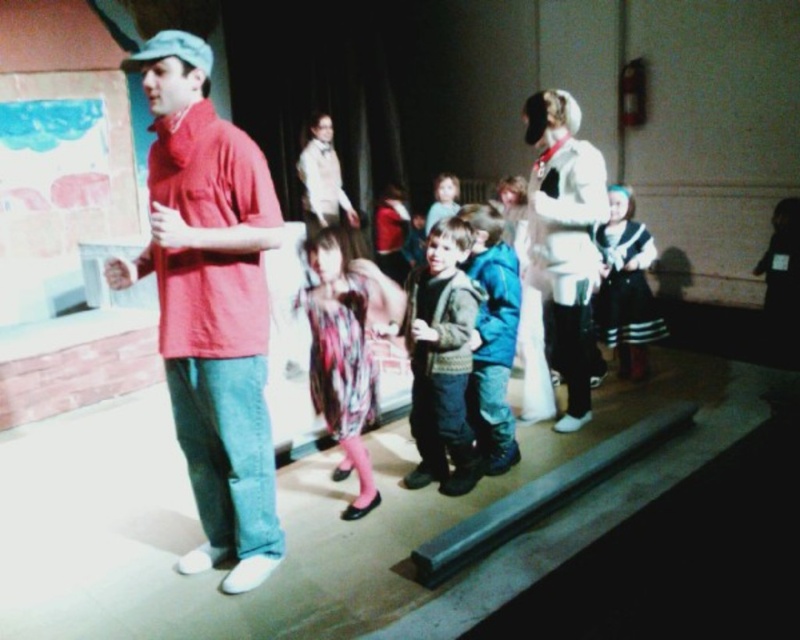
In the scene shown: You are a photographer trying to capture a group photo of the green fuzzy jacket at center and the sailor dress at center. The camera you have can only focus on objects within a 1.5 meter range. Will both subjects be in focus?

The green fuzzy jacket at center is 1.75 meters from the sailor dress at center. Since the camera can only focus within 1.5 meters, the distance between them exceeds the focus range, so both subjects will not be in focus.